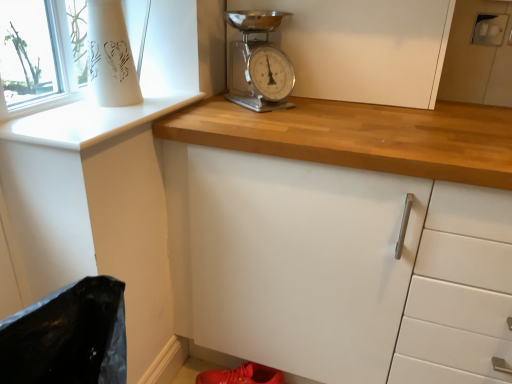
Question: Is white matte cabinet at center in front of white glossy window sill at upper left?

Choices:
 (A) yes
 (B) no

Answer: (B)

Question: Is white matte cabinet at center smaller than white glossy window sill at upper left?

Choices:
 (A) no
 (B) yes

Answer: (A)

Question: Can you confirm if white matte cabinet at center is wider than white glossy window sill at upper left?

Choices:
 (A) yes
 (B) no

Answer: (B)

Question: Can you confirm if white matte cabinet at center is positioned to the right of white glossy window sill at upper left?

Choices:
 (A) no
 (B) yes

Answer: (B)

Question: From a real-world perspective, is white matte cabinet at center on white glossy window sill at upper left?

Choices:
 (A) no
 (B) yes

Answer: (B)

Question: Is white matte cabinet at center not inside white glossy window sill at upper left?

Choices:
 (A) no
 (B) yes

Answer: (B)

Question: Is chrome metallic scale at upper center positioned with its back to shiny red shoe at lower center?

Choices:
 (A) yes
 (B) no

Answer: (B)

Question: Can you confirm if chrome metallic scale at upper center is thinner than shiny red shoe at lower center?

Choices:
 (A) no
 (B) yes

Answer: (A)

Question: Is chrome metallic scale at upper center further to camera compared to shiny red shoe at lower center?

Choices:
 (A) no
 (B) yes

Answer: (A)

Question: Considering the relative positions of chrome metallic scale at upper center and shiny red shoe at lower center in the image provided, is chrome metallic scale at upper center to the left of shiny red shoe at lower center from the viewer's perspective?

Choices:
 (A) no
 (B) yes

Answer: (A)

Question: From the image's perspective, would you say chrome metallic scale at upper center is positioned over shiny red shoe at lower center?

Choices:
 (A) yes
 (B) no

Answer: (A)

Question: Does chrome metallic scale at upper center turn towards shiny red shoe at lower center?

Choices:
 (A) no
 (B) yes

Answer: (A)

Question: From a real-world perspective, does white matte cabinet at center sit lower than chrome metallic scale at upper center?

Choices:
 (A) yes
 (B) no

Answer: (B)